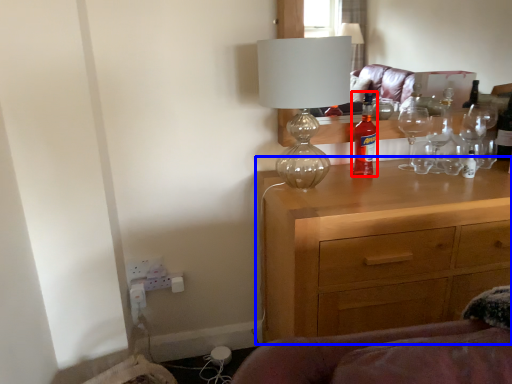
Question: Among these objects, which one is farthest to the camera, bottle (highlighted by a red box) or chest of drawers (highlighted by a blue box)?

Choices:
 (A) bottle
 (B) chest of drawers

Answer: (A)